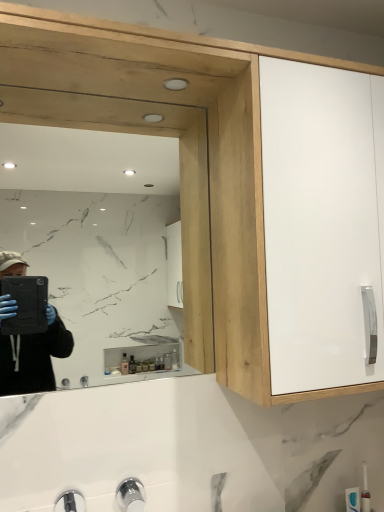
Question: Considering the relative sizes of clear glass mirror at upper left and white glossy cabinet door at upper right in the image provided, is clear glass mirror at upper left shorter than white glossy cabinet door at upper right?

Choices:
 (A) no
 (B) yes

Answer: (B)

Question: Does clear glass mirror at upper left have a lesser width compared to white glossy cabinet door at upper right?

Choices:
 (A) yes
 (B) no

Answer: (A)

Question: From the image's perspective, is clear glass mirror at upper left located beneath white glossy cabinet door at upper right?

Choices:
 (A) no
 (B) yes

Answer: (B)

Question: Is clear glass mirror at upper left oriented away from white glossy cabinet door at upper right?

Choices:
 (A) yes
 (B) no

Answer: (B)

Question: Is clear glass mirror at upper left behind white glossy cabinet door at upper right?

Choices:
 (A) no
 (B) yes

Answer: (B)

Question: Considering the relative positions of clear glass mirror at upper left and white glossy cabinet door at upper right in the image provided, is clear glass mirror at upper left to the right of white glossy cabinet door at upper right from the viewer's perspective?

Choices:
 (A) no
 (B) yes

Answer: (A)

Question: From the image's perspective, is white glossy cabinet door at upper right below clear glass mirror at upper left?

Choices:
 (A) no
 (B) yes

Answer: (A)

Question: From the image's perspective, is white glossy cabinet door at upper right over clear glass mirror at upper left?

Choices:
 (A) yes
 (B) no

Answer: (A)

Question: Does white glossy cabinet door at upper right come in front of clear glass mirror at upper left?

Choices:
 (A) yes
 (B) no

Answer: (A)

Question: Considering the relative positions of white glossy cabinet door at upper right and clear glass mirror at upper left in the image provided, is white glossy cabinet door at upper right to the left of clear glass mirror at upper left from the viewer's perspective?

Choices:
 (A) no
 (B) yes

Answer: (A)

Question: Does white glossy cabinet door at upper right have a greater width compared to clear glass mirror at upper left?

Choices:
 (A) yes
 (B) no

Answer: (A)

Question: Can you confirm if white glossy cabinet door at upper right is shorter than clear glass mirror at upper left?

Choices:
 (A) yes
 (B) no

Answer: (B)

Question: Would you say clear glass mirror at upper left is inside or outside white glossy cabinet door at upper right?

Choices:
 (A) outside
 (B) inside

Answer: (A)